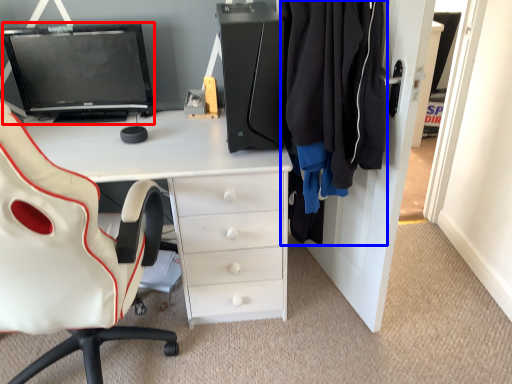
Question: Among these objects, which one is nearest to the camera, computer monitor (highlighted by a red box) or clothing (highlighted by a blue box)?

Choices:
 (A) computer monitor
 (B) clothing

Answer: (B)